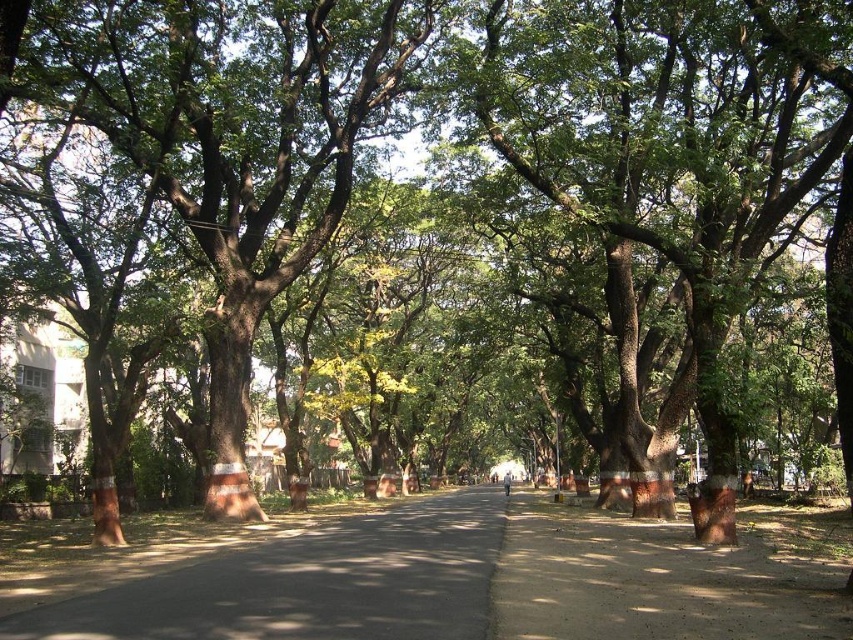
Does brown rough bark tree at center appear over dark asphalt road at center?

Yes, brown rough bark tree at center is above dark asphalt road at center.

Is brown rough bark tree at center thinner than dark asphalt road at center?

Incorrect, brown rough bark tree at center's width is not less than dark asphalt road at center's.

The image size is (853, 640). Find the location of `brown rough bark tree at center`. brown rough bark tree at center is located at coordinates (666, 148).

Which is below, brown rough bark tree at center or brown dirt pavement at center?

brown dirt pavement at center is below.

Is point (607, 76) positioned after point (573, 544)?

That is True.

You are a GUI agent. You are given a task and a screenshot of the screen. Output one action in this format:
    pyautogui.click(x=<x>, y=<y>)
    Task: Click on the brown rough bark tree at center
    Image resolution: width=853 pixels, height=640 pixels.
    Given the screenshot: What is the action you would take?
    pyautogui.click(x=666, y=148)

Can you confirm if dark asphalt road at center is positioned to the left of brown dirt pavement at center?

Yes, dark asphalt road at center is to the left of brown dirt pavement at center.

Can you confirm if dark asphalt road at center is positioned below brown dirt pavement at center?

Correct, dark asphalt road at center is located below brown dirt pavement at center.

Which is in front, point (306, 536) or point (657, 552)?

Point (657, 552) is more forward.

Where is `dark asphalt road at center`? The height and width of the screenshot is (640, 853). dark asphalt road at center is located at coordinates (309, 582).